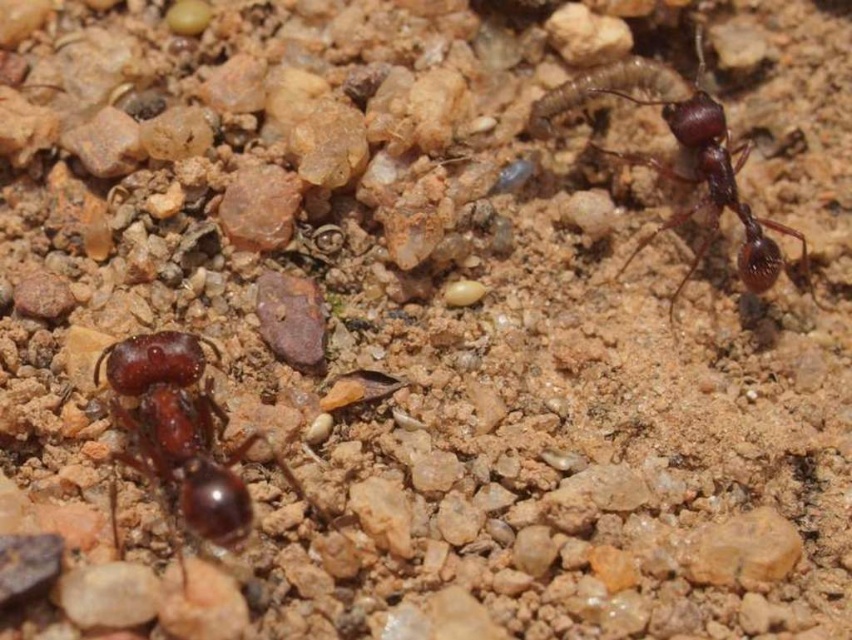
Question: Which of the following is the closest to the observer?

Choices:
 (A) shiny dark brown ant at upper right
 (B) shiny dark brown ant at lower left

Answer: (B)

Question: Among these objects, which one is nearest to the camera?

Choices:
 (A) shiny dark brown ant at upper right
 (B) shiny dark brown ant at lower left

Answer: (B)

Question: Is shiny dark brown ant at lower left below shiny dark brown ant at upper right?

Choices:
 (A) yes
 (B) no

Answer: (A)

Question: Is shiny dark brown ant at lower left closer to camera compared to shiny dark brown ant at upper right?

Choices:
 (A) no
 (B) yes

Answer: (B)

Question: Does shiny dark brown ant at lower left come in front of shiny dark brown ant at upper right?

Choices:
 (A) no
 (B) yes

Answer: (B)

Question: Which of the following is the farthest from the observer?

Choices:
 (A) (140, 404)
 (B) (756, 291)

Answer: (B)